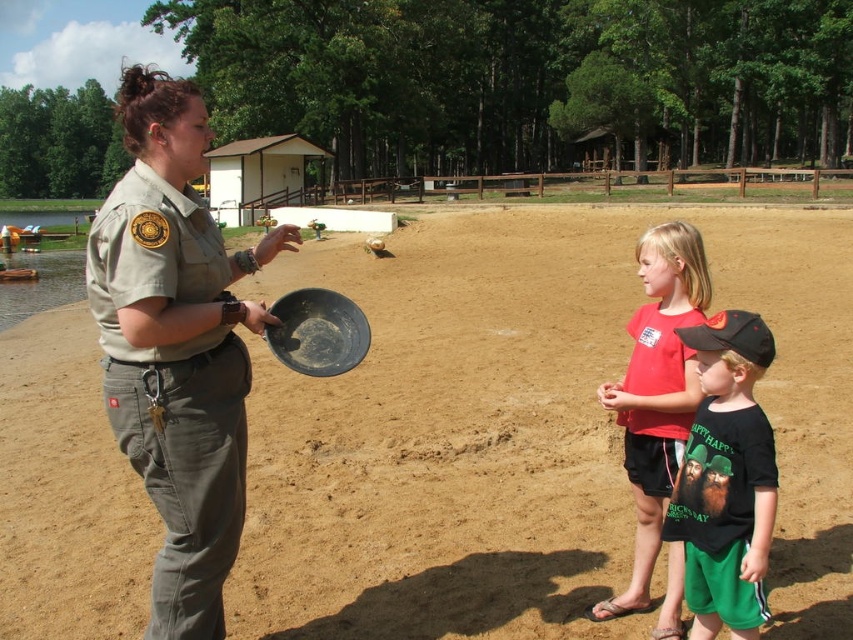
Who is more distant from viewer, (555, 515) or (666, 593)?

Positioned behind is point (555, 515).

Image resolution: width=853 pixels, height=640 pixels. I want to click on brown sandy dirt at center, so click(x=523, y=429).

Looking at this image, does red cotton shirt at center have a greater width compared to red matte t-shirt at center?

Indeed, red cotton shirt at center has a greater width compared to red matte t-shirt at center.

Can you confirm if red cotton shirt at center is positioned to the right of red matte t-shirt at center?

Correct, you'll find red cotton shirt at center to the right of red matte t-shirt at center.

Describe the element at coordinates (656, 394) in the screenshot. I see `red cotton shirt at center` at that location.

Identify the location of red cotton shirt at center. The height and width of the screenshot is (640, 853). (656, 394).

Can you confirm if green cotton shorts at lower right is bigger than red matte t-shirt at center?

Indeed, green cotton shorts at lower right has a larger size compared to red matte t-shirt at center.

Can you confirm if green cotton shorts at lower right is wider than red matte t-shirt at center?

In fact, green cotton shorts at lower right might be narrower than red matte t-shirt at center.

I want to click on green cotton shorts at lower right, so click(x=726, y=480).